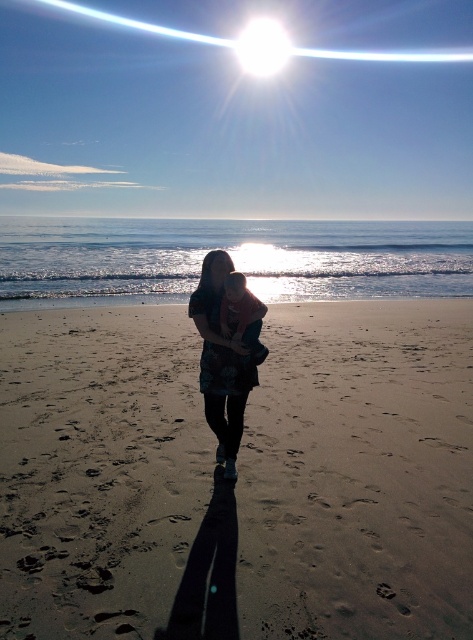
Question: Can you confirm if sandy brown at center is smaller than soft pink fabric baby at center?

Choices:
 (A) yes
 (B) no

Answer: (B)

Question: Does sandy brown at center lie in front of matte blue dress at center?

Choices:
 (A) no
 (B) yes

Answer: (B)

Question: Among these points, which one is farthest from the camera?

Choices:
 (A) (421, 488)
 (B) (222, 336)
 (C) (219, 371)

Answer: (C)

Question: Estimate the real-world distances between objects in this image. Which object is closer to the soft pink fabric baby at center?

Choices:
 (A) matte blue dress at center
 (B) sandy brown at center

Answer: (A)

Question: Which object is positioned closest to the matte blue dress at center?

Choices:
 (A) sandy brown at center
 (B) soft pink fabric baby at center

Answer: (B)

Question: Is matte blue dress at center wider than soft pink fabric baby at center?

Choices:
 (A) yes
 (B) no

Answer: (A)